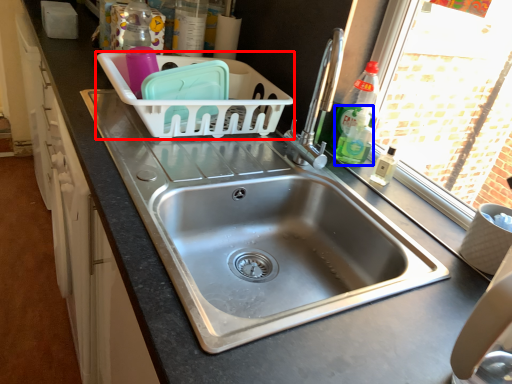
Question: Which of the following is the closest to the observer, basket (highlighted by a red box) or bottle (highlighted by a blue box)?

Choices:
 (A) basket
 (B) bottle

Answer: (A)